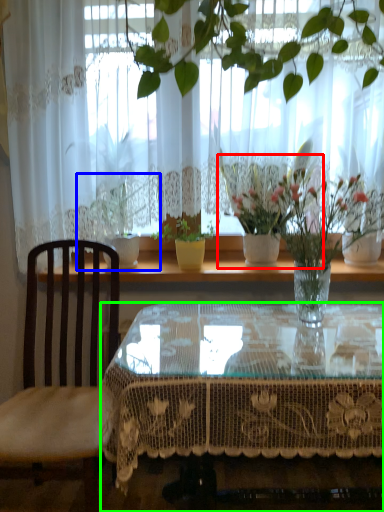
Question: Estimate the real-world distances between objects in this image. Which object is farther from houseplant (highlighted by a red box), houseplant (highlighted by a blue box) or coffee table (highlighted by a green box)?

Choices:
 (A) houseplant
 (B) coffee table

Answer: (A)